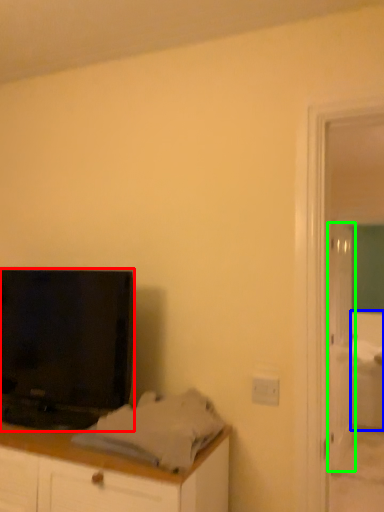
Question: Which is farther away from television (highlighted by a red box)? bed (highlighted by a blue box) or door (highlighted by a green box)?

Choices:
 (A) bed
 (B) door

Answer: (A)